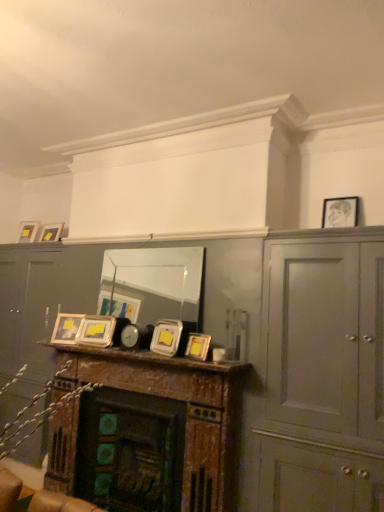
Question: Considering the positions of point (276, 251) and point (69, 325), is point (276, 251) closer or farther from the camera than point (69, 325)?

Choices:
 (A) farther
 (B) closer

Answer: (B)

Question: Is matte gray cabinet at right bigger or smaller than matte silver picture frame at center, which ranks as the fifth picture frame in front-to-back order?

Choices:
 (A) big
 (B) small

Answer: (A)

Question: Estimate the real-world distances between objects in this image. Which object is farther from the matte black picture frame at upper right, which is counted as the first picture frame, starting from the right?

Choices:
 (A) wooden mantel at center
 (B) matte gray cabinet at right
 (C) clear glass mirror at center
 (D) matte gold picture frame at upper left, acting as the second picture frame starting from the top
 (E) metallic silver frames at center

Answer: (D)

Question: Which object is positioned closest to the matte black picture frame at upper right, which is counted as the first picture frame, starting from the right?

Choices:
 (A) clear glass mirror at center
 (B) matte silver picture frame at center, positioned as the second picture frame in left-to-right order
 (C) metallic silver clock at center
 (D) matte gold picture frame at center, positioned as the sixth picture frame in top-to-bottom order
 (E) matte gold picture frame at upper left, arranged as the sixth picture frame when viewed from the front

Answer: (D)